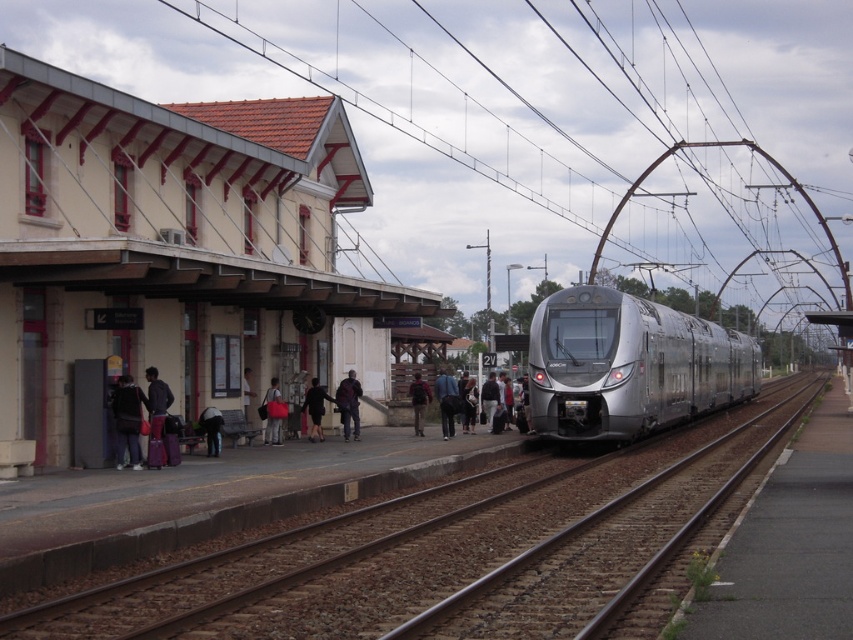
You are a traveler standing on the platform at the train station. You need to place your dark brown backpack at center on the ground so it doesn not get in the way of the metal tracks at center. Where should you position it relative to the tracks?

The metal tracks at center are located below the dark brown backpack at center, so you should move the dark brown backpack at center away from the tracks to a position above them to avoid blocking the tracks.

You are a passenger waiting at the train station. You see the metal tracks at center and the dark gray fabric jacket at left. Which object is closer to you as you stand on the platform?

The metal tracks at center are closer to you because they are in front of the dark gray fabric jacket at left.